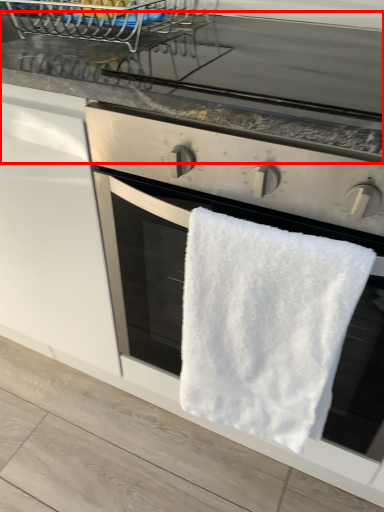
Question: Observing the image, what is the correct spatial positioning of countertop (annotated by the red box) in reference to towel/napkin?

Choices:
 (A) right
 (B) left

Answer: (A)